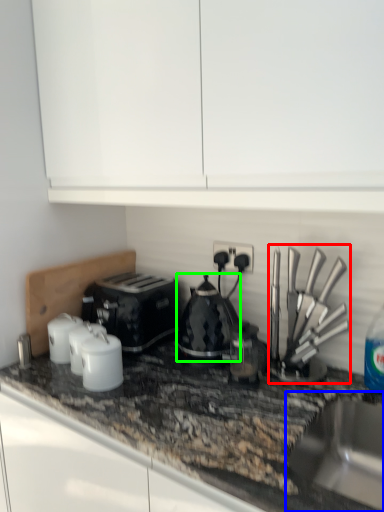
Question: Which is farther away from kitchen appliance (highlighted by a red box)? sink (highlighted by a blue box) or kitchen appliance (highlighted by a green box)?

Choices:
 (A) sink
 (B) kitchen appliance

Answer: (B)